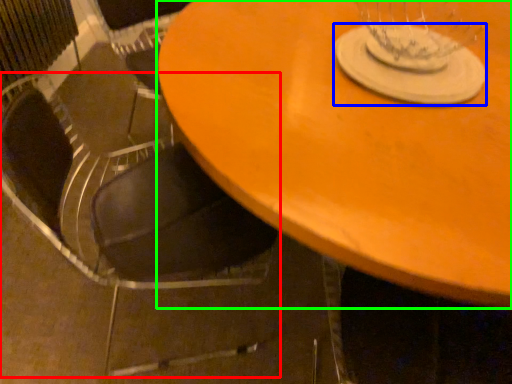
Question: Which object is positioned closest to chair (highlighted by a red box)? Select from glass plate (highlighted by a blue box) and table (highlighted by a green box).

Choices:
 (A) glass plate
 (B) table

Answer: (B)